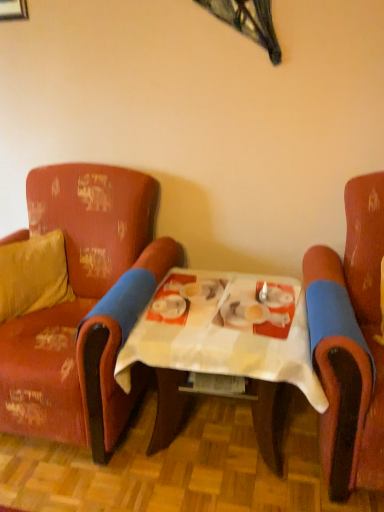
Where is `free point above white checkered table at center (from a real-world perspective)`? This screenshot has width=384, height=512. free point above white checkered table at center (from a real-world perspective) is located at coordinates (239, 309).